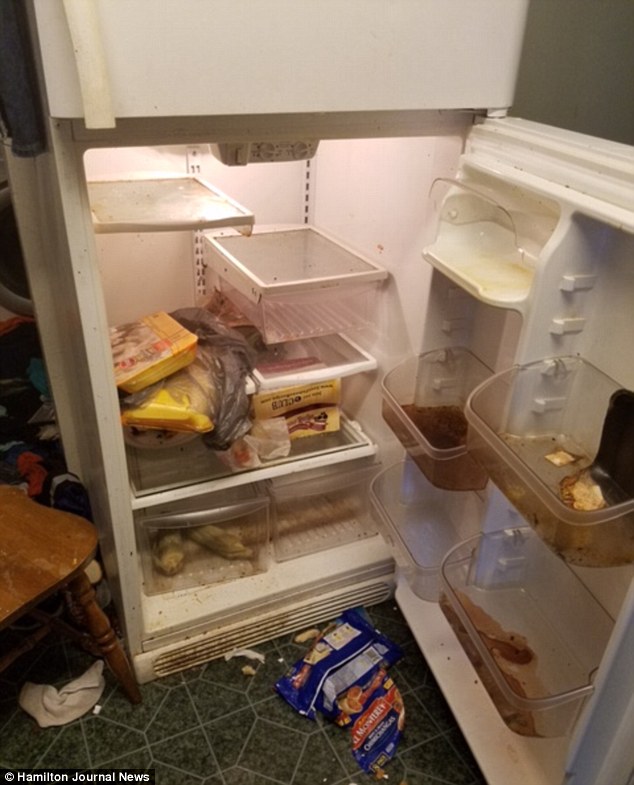
In order to click on flooring right underneath chair in this screenshot , I will do 49,661.